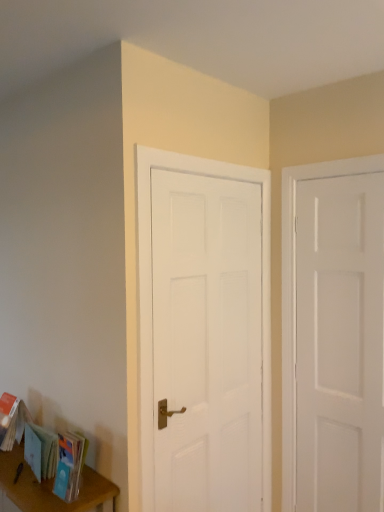
At what (x,y) coordinates should I click in order to perform the action: click on free space to the right of matte blue paperback book at lower left. Please return your answer as a coordinate pair (x, y). This screenshot has height=512, width=384. Looking at the image, I should click on (94, 492).